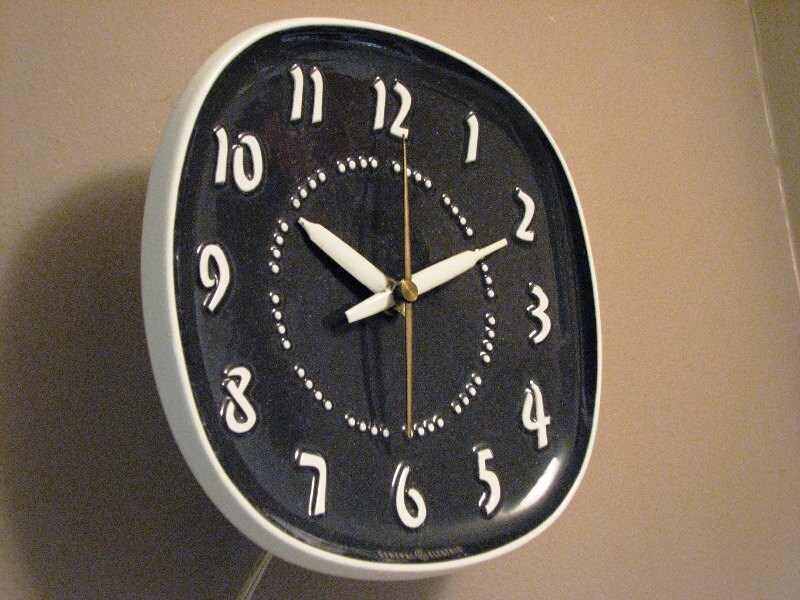
This screenshot has width=800, height=600. I want to click on white frame of clock, so click(170, 393).